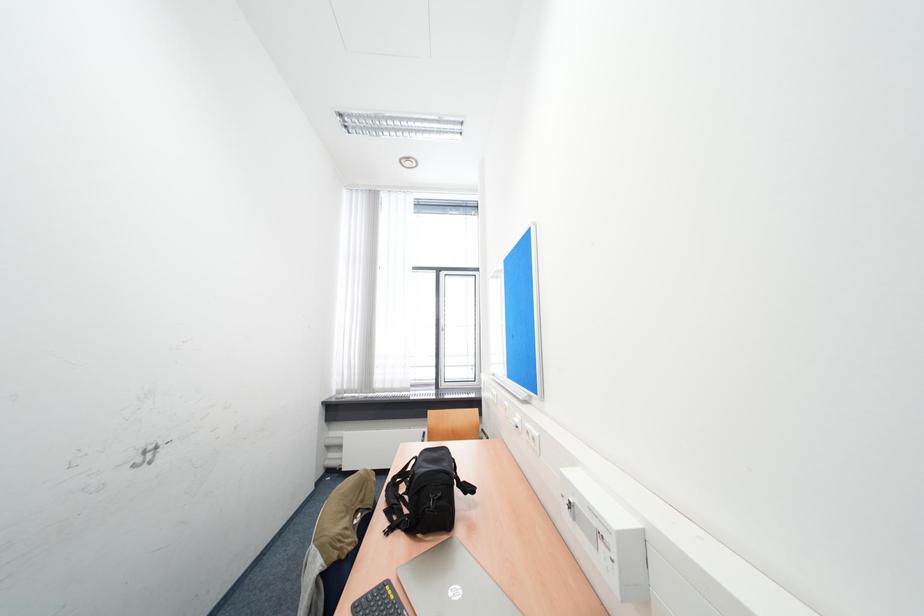
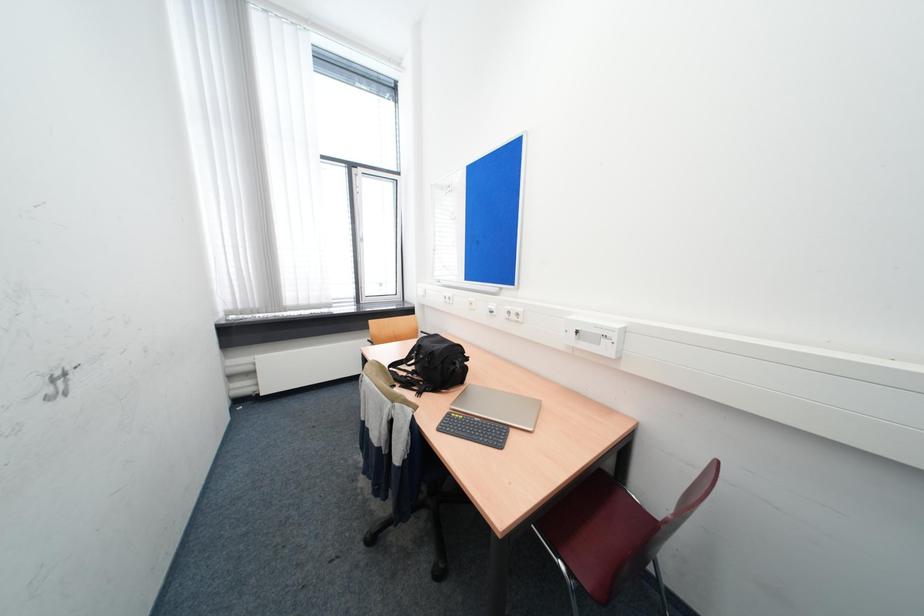
The first image is from the beginning of the video and the second image is from the end. How did the camera likely rotate when shooting the video?

The rotation direction of the camera is right-down.